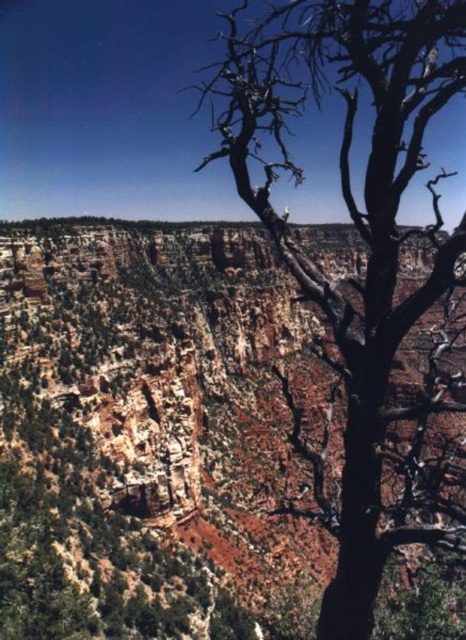
Can you confirm if rustic rock canyon at center is positioned below dead wood tree at right?

Correct, rustic rock canyon at center is located below dead wood tree at right.

Between rustic rock canyon at center and dead wood tree at right, which one is positioned lower?

rustic rock canyon at center is below.

Who is more forward, [0,476] or [423,13]?

Positioned in front is point [423,13].

At what (x,y) coordinates should I click in order to perform the action: click on rustic rock canyon at center. Please return your answer as a coordinate pair (x, y). Looking at the image, I should click on (159, 435).